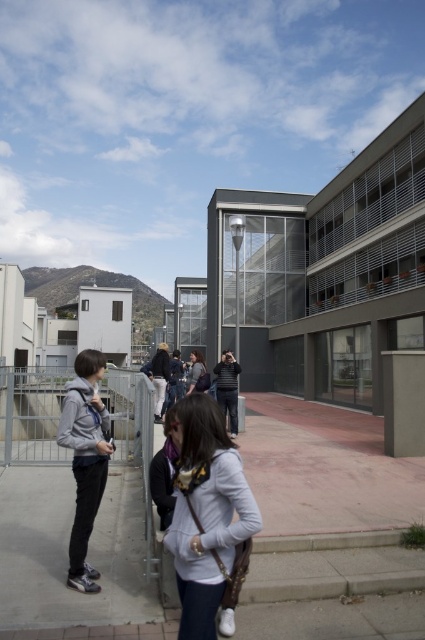
You are standing in front of the modern building and want to pick up an item. Which item is easier to reach, the light gray fabric backpack at center or the gray hoodie at left?

The light gray fabric backpack at center is closer to the viewer than the gray hoodie at left, so it is easier to reach.

You are taking a photo of the group and want to ensure both the gray hoodie at left and the striped sweater at center are in the frame. Based on their positions, which direction should you move the camera to include both?

Since the gray hoodie at left is to the left of striped sweater at center, you should move the camera to the left to include both the gray hoodie at left and the striped sweater at center in the frame.

You are organizing a backpacking trip and need to decide which item to pack first between the light gray fabric backpack at center and the striped sweater at center. Based on their sizes, which one should you choose to ensure you have enough space?

The light gray fabric backpack at center is bigger than the striped sweater at center, so you should pack the striped sweater at center first to ensure it fits inside the backpack.